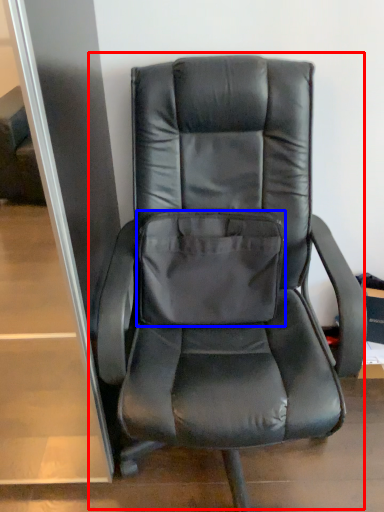
Question: Which object appears farthest to the camera in this image, chair (highlighted by a red box) or pocket (highlighted by a blue box)?

Choices:
 (A) chair
 (B) pocket

Answer: (B)